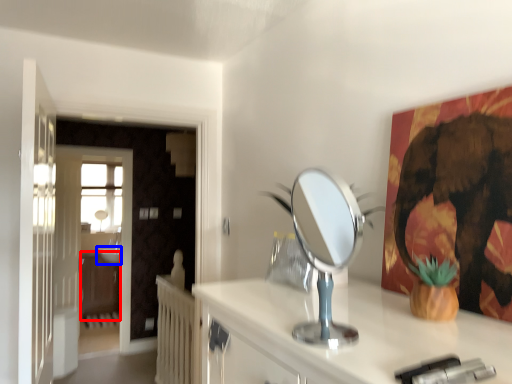
Question: Which object is further to the camera taking this photo, dresser (highlighted by a red box) or sink (highlighted by a blue box)?

Choices:
 (A) dresser
 (B) sink

Answer: (B)